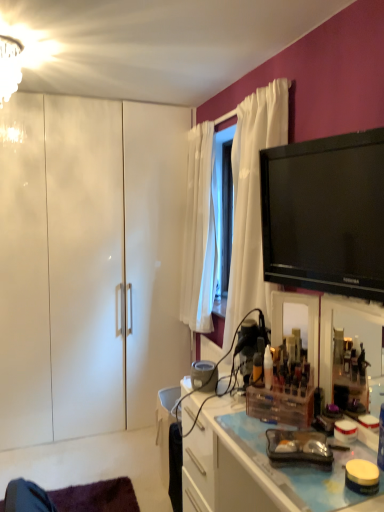
Question: Are black glossy tv at upper right and clear plastic organizer at center, which is the 1th cabinetry from right to left, located far from each other?

Choices:
 (A) no
 (B) yes

Answer: (A)

Question: From the image's perspective, is black glossy tv at upper right on clear plastic organizer at center, which is the 1th cabinetry from right to left?

Choices:
 (A) no
 (B) yes

Answer: (B)

Question: Considering the relative sizes of black glossy tv at upper right and clear plastic organizer at center, which is the 1th cabinetry from right to left, in the image provided, is black glossy tv at upper right smaller than clear plastic organizer at center, which is the 1th cabinetry from right to left,?

Choices:
 (A) no
 (B) yes

Answer: (B)

Question: From a real-world perspective, is black glossy tv at upper right over clear plastic organizer at center, the first cabinetry when ordered from front to back?

Choices:
 (A) no
 (B) yes

Answer: (B)

Question: Considering the relative sizes of black glossy tv at upper right and clear plastic organizer at center, marked as the 2th cabinetry in a left-to-right arrangement, in the image provided, is black glossy tv at upper right thinner than clear plastic organizer at center, marked as the 2th cabinetry in a left-to-right arrangement,?

Choices:
 (A) no
 (B) yes

Answer: (B)

Question: From the image's perspective, would you say black glossy tv at upper right is shown under clear plastic organizer at center, which ranks as the 2th cabinetry in back-to-front order?

Choices:
 (A) no
 (B) yes

Answer: (A)

Question: Does white glossy cabinet at left, acting as the 1th cabinetry starting from the back, turn towards clear plastic organizer at center, which ranks as the 2th cabinetry in back-to-front order?

Choices:
 (A) no
 (B) yes

Answer: (B)

Question: Does white glossy cabinet at left, the second cabinetry from the front, have a larger size compared to clear plastic organizer at center, which is the 1th cabinetry from right to left?

Choices:
 (A) no
 (B) yes

Answer: (B)

Question: From a real-world perspective, is white glossy cabinet at left, the 1th cabinetry when ordered from left to right, located beneath clear plastic organizer at center, marked as the 2th cabinetry in a left-to-right arrangement?

Choices:
 (A) no
 (B) yes

Answer: (A)

Question: Is white glossy cabinet at left, acting as the 1th cabinetry starting from the back, facing away from clear plastic organizer at center, marked as the 2th cabinetry in a left-to-right arrangement?

Choices:
 (A) no
 (B) yes

Answer: (A)

Question: Is white glossy cabinet at left, acting as the 1th cabinetry starting from the back, smaller than clear plastic organizer at center, which ranks as the 2th cabinetry in back-to-front order?

Choices:
 (A) yes
 (B) no

Answer: (B)

Question: From the image's perspective, is white glossy cabinet at left, acting as the 1th cabinetry starting from the back, located above clear plastic organizer at center, marked as the 2th cabinetry in a left-to-right arrangement?

Choices:
 (A) yes
 (B) no

Answer: (A)

Question: Considering the relative sizes of clear plastic organizer at center, marked as the 2th cabinetry in a left-to-right arrangement, and white glass chandelier at upper left in the image provided, is clear plastic organizer at center, marked as the 2th cabinetry in a left-to-right arrangement, shorter than white glass chandelier at upper left?

Choices:
 (A) yes
 (B) no

Answer: (B)